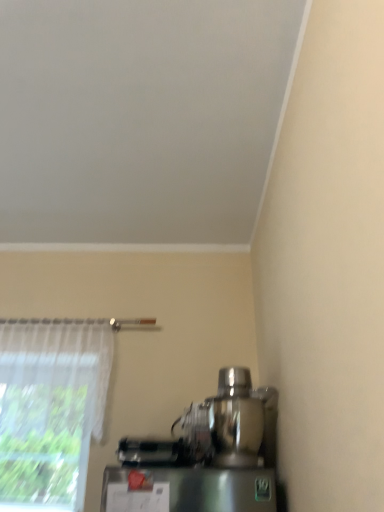
Question: Visually, is sheer white curtain at left positioned to the left or to the right of shiny metallic mixer at lower right?

Choices:
 (A) left
 (B) right

Answer: (A)

Question: Looking at their shapes, would you say sheer white curtain at left is wider or thinner than shiny metallic mixer at lower right?

Choices:
 (A) thin
 (B) wide

Answer: (A)

Question: From the image's perspective, relative to shiny metallic mixer at lower right, is sheer white curtain at left above or below?

Choices:
 (A) above
 (B) below

Answer: (A)

Question: Looking at their shapes, would you say shiny metallic mixer at lower right is wider or thinner than sheer white curtain at left?

Choices:
 (A) wide
 (B) thin

Answer: (A)

Question: From a real-world perspective, is shiny metallic mixer at lower right above or below sheer white curtain at left?

Choices:
 (A) below
 (B) above

Answer: (A)

Question: From the image's perspective, is shiny metallic mixer at lower right above or below sheer white curtain at left?

Choices:
 (A) below
 (B) above

Answer: (A)

Question: Is point (238, 369) closer or farther from the camera than point (104, 342)?

Choices:
 (A) farther
 (B) closer

Answer: (B)